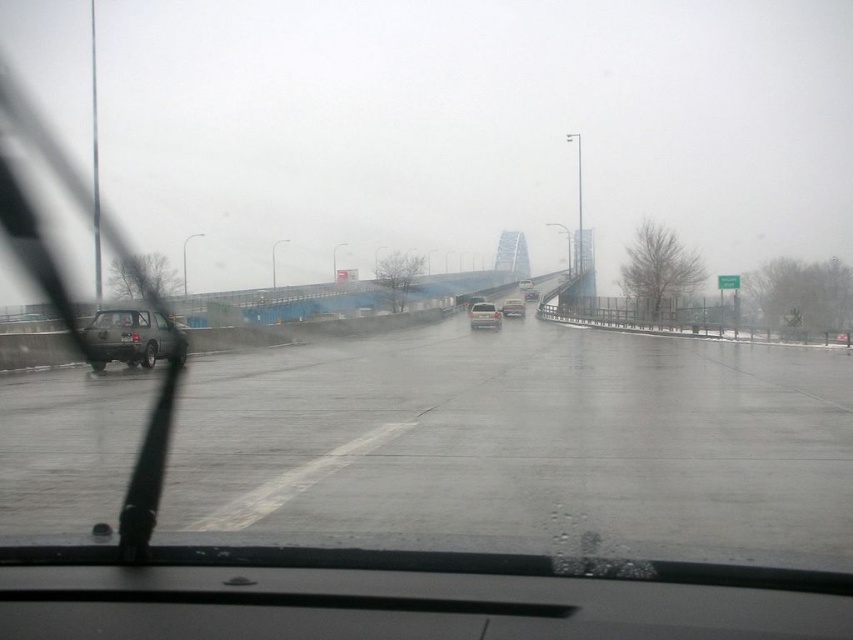
Question: Is gray asphalt highway at left bigger than matte silver suv at center?

Choices:
 (A) yes
 (B) no

Answer: (A)

Question: Among these points, which one is nearest to the camera?

Choices:
 (A) (526, 292)
 (B) (165, 340)
 (C) (207, 356)
 (D) (495, 326)

Answer: (B)

Question: Does white matte van at center have a lesser width compared to matte silver suv at center?

Choices:
 (A) yes
 (B) no

Answer: (A)

Question: Does gray asphalt highway at left have a greater width compared to transparent glass windshield at left?

Choices:
 (A) no
 (B) yes

Answer: (A)

Question: Among these points, which one is nearest to the camera?

Choices:
 (A) (480, 324)
 (B) (107, 353)
 (C) (18, 184)

Answer: (B)

Question: Which point is closer to the camera?

Choices:
 (A) (122, 346)
 (B) (531, 292)

Answer: (A)